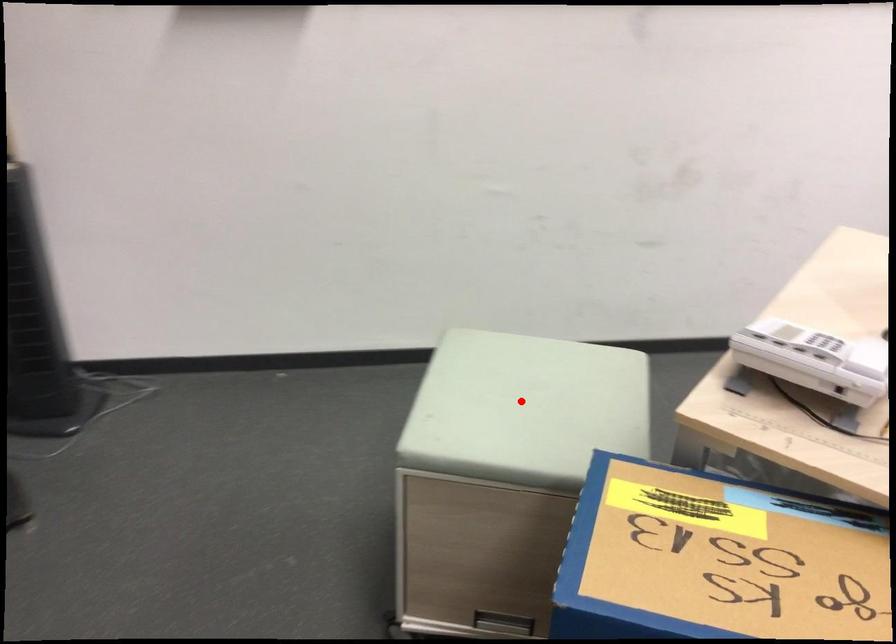
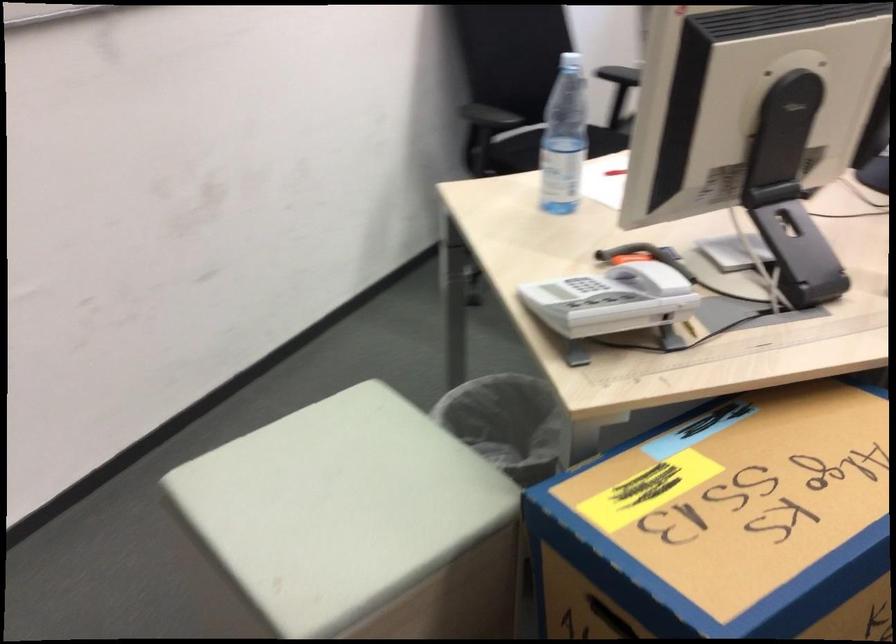
Question: I am providing you with two images of the same scene from different viewpoints. Given a red point in image1, look at the same physical point in image2. Is it:

Choices:
 (A) Closer to the viewpoint
 (B) Farther from the viewpoint

Answer: (A)